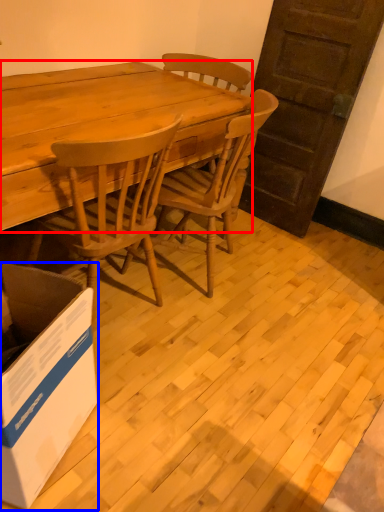
Question: Which of the following is the farthest to the observer, desk (highlighted by a red box) or box (highlighted by a blue box)?

Choices:
 (A) desk
 (B) box

Answer: (A)